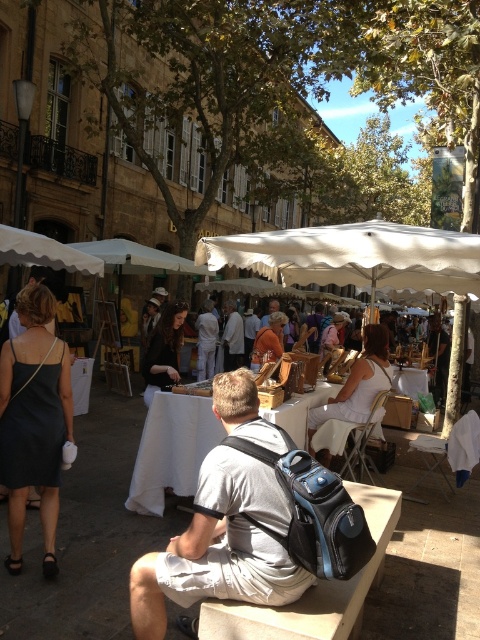
Consider the image. Who is taller, wooden table at center or white cloth table at center?

With more height is white cloth table at center.

From the picture: Does wooden table at center have a greater height compared to white cloth table at center?

No, wooden table at center is not taller than white cloth table at center.

At what (x,y) coordinates should I click in order to perform the action: click on wooden table at center. Please return your answer as a coordinate pair (x, y). The image size is (480, 640). Looking at the image, I should click on (87, 534).

Locate an element on the screen. wooden table at center is located at coordinates (87, 534).

Is white cloth table at center closer to camera compared to light brown leather jacket at center?

That is True.

What do you see at coordinates (171, 449) in the screenshot?
I see `white cloth table at center` at bounding box center [171, 449].

This screenshot has width=480, height=640. Find the location of `white cloth table at center`. white cloth table at center is located at coordinates (171, 449).

Does wooden table at center come behind light brown leather jacket at center?

No, wooden table at center is closer to the viewer.

This screenshot has height=640, width=480. I want to click on wooden table at center, so click(87, 534).

Where is `wooden table at center`? Image resolution: width=480 pixels, height=640 pixels. wooden table at center is located at coordinates (87, 534).